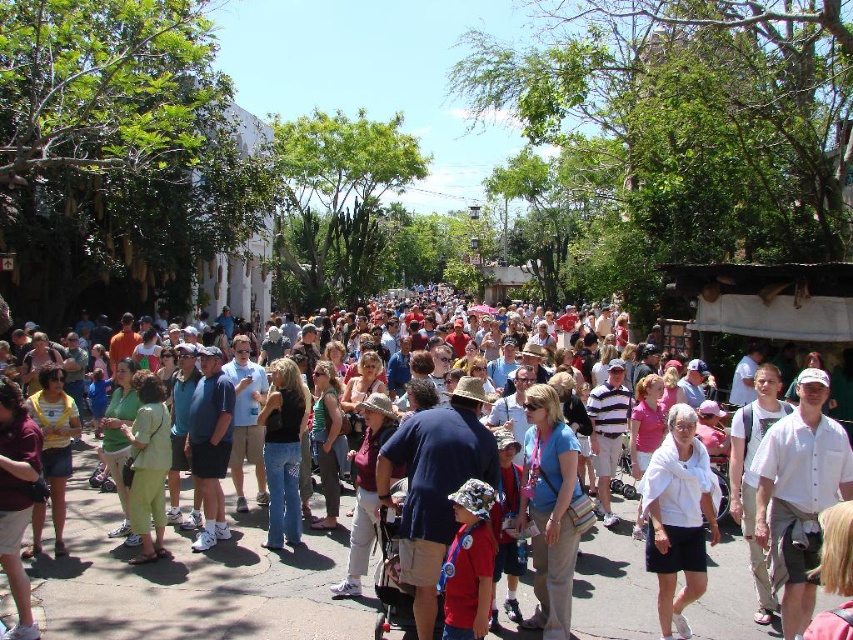
You are a photographer at the event and want to capture a clear shot of the white cotton shirt at center and the green cotton shorts at center. Since the crowd is dense, you need to adjust your lens to focus on the thinner object. Which object should you focus on?

The white cotton shirt at center is thinner than the green cotton shorts at center, so you should focus on the white cotton shirt at center.

You are standing in the crowd at the event and want to take a photo of both the point at coordinates point (689, 456) and point (136, 392). Which point will appear larger in your photo?

Point (689, 456) is closer to the camera than point (136, 392), so it will appear larger in the photo.